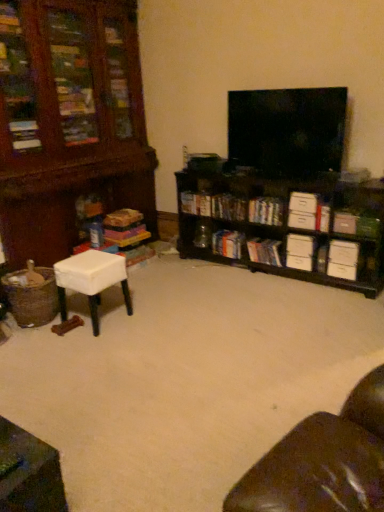
Where is `free space on the front side of black wood shelf at center right`? free space on the front side of black wood shelf at center right is located at coordinates (281, 337).